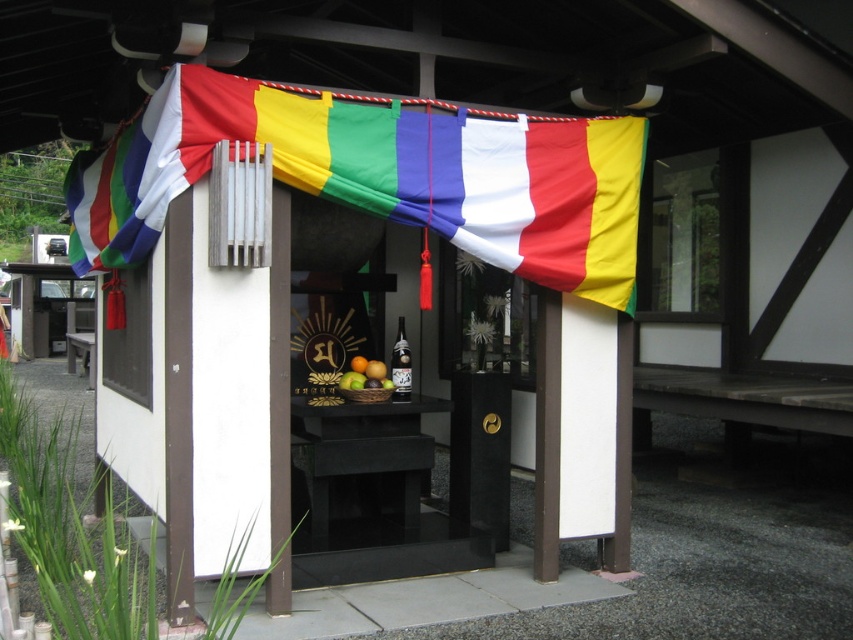
Question: Does multicolored fabric banner at upper center appear over glossy wooden bowl at center?

Choices:
 (A) yes
 (B) no

Answer: (A)

Question: Can you confirm if multicolored fabric banner at upper center is wider than glossy wooden bowl at center?

Choices:
 (A) no
 (B) yes

Answer: (B)

Question: Does multicolored fabric banner at upper center appear over glossy wooden bowl at center?

Choices:
 (A) yes
 (B) no

Answer: (A)